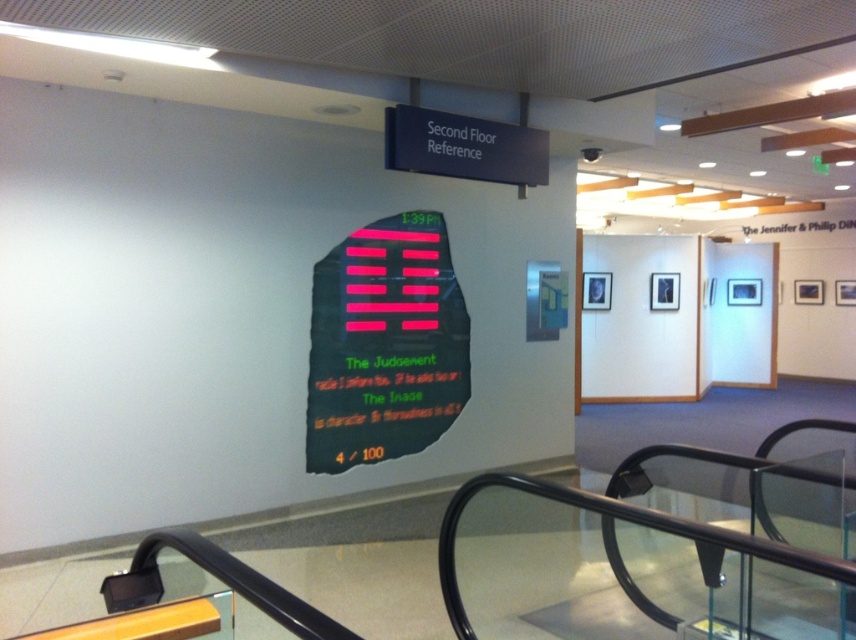
Question: Is pink matte sign at center positioned at the back of black plastic sign at upper center?

Choices:
 (A) no
 (B) yes

Answer: (B)

Question: Which of the following is the farthest from the observer?

Choices:
 (A) black plastic sign at upper center
 (B) pink matte sign at center

Answer: (B)

Question: Observing the image, what is the correct spatial positioning of pink matte sign at center in reference to black plastic sign at upper center?

Choices:
 (A) left
 (B) right

Answer: (A)

Question: Can you confirm if pink matte sign at center is positioned to the right of black plastic sign at upper center?

Choices:
 (A) yes
 (B) no

Answer: (B)

Question: Which object appears closest to the camera in this image?

Choices:
 (A) black plastic sign at upper center
 (B) pink matte sign at center

Answer: (A)